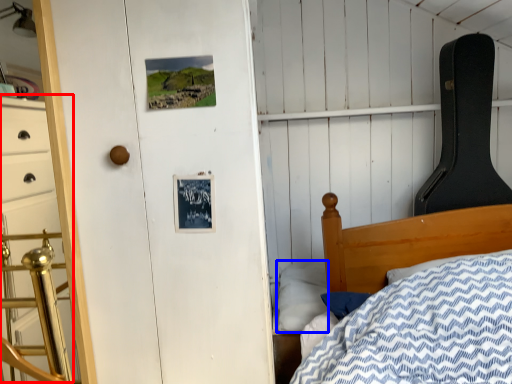
Question: Which of the following is the closest to the observer, dresser (highlighted by a red box) or pillow (highlighted by a blue box)?

Choices:
 (A) dresser
 (B) pillow

Answer: (A)